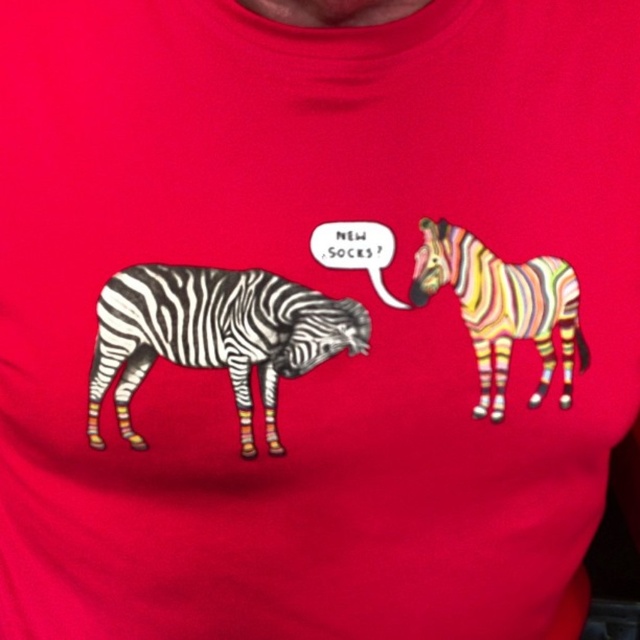
Which of these two, black and white striped zebra at left or rainbow striped zebra at right, stands taller?

rainbow striped zebra at right is taller.

Which is behind, point (362, 333) or point (572, 268)?

Point (572, 268)

At what (x,y) coordinates should I click in order to perform the action: click on black and white striped zebra at left. Please return your answer as a coordinate pair (x, y). This screenshot has width=640, height=640. Looking at the image, I should click on (214, 337).